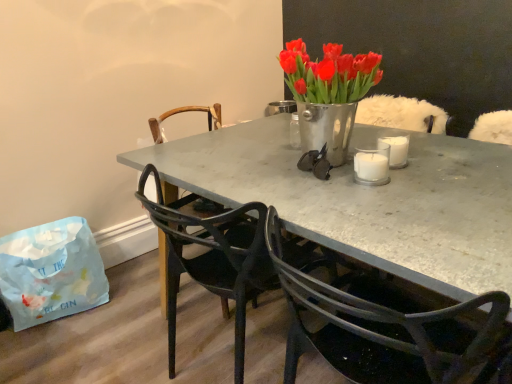
Question: Considering the relative sizes of wooden chair at center, the 1th chair viewed from the back, and matte black chair at center, the second chair from the back, in the image provided, is wooden chair at center, the 1th chair viewed from the back, bigger than matte black chair at center, the second chair from the back,?

Choices:
 (A) no
 (B) yes

Answer: (A)

Question: Considering the relative positions of wooden chair at center, the 3th chair positioned from the front, and matte black chair at center, which is the second chair in front-to-back order, in the image provided, is wooden chair at center, the 3th chair positioned from the front, behind matte black chair at center, which is the second chair in front-to-back order,?

Choices:
 (A) yes
 (B) no

Answer: (A)

Question: Considering the relative positions of wooden chair at center, the 1th chair viewed from the back, and matte black chair at center, the second chair from the back, in the image provided, is wooden chair at center, the 1th chair viewed from the back, to the right of matte black chair at center, the second chair from the back, from the viewer's perspective?

Choices:
 (A) yes
 (B) no

Answer: (B)

Question: Is wooden chair at center, the 3th chair positioned from the front, closer to camera compared to matte black chair at center, the second chair from the back?

Choices:
 (A) yes
 (B) no

Answer: (B)

Question: Considering the relative sizes of wooden chair at center, the 1th chair viewed from the back, and matte black chair at center, which is the second chair in front-to-back order, in the image provided, is wooden chair at center, the 1th chair viewed from the back, taller than matte black chair at center, which is the second chair in front-to-back order,?

Choices:
 (A) yes
 (B) no

Answer: (B)

Question: From the image's perspective, is wooden chair at center, the 3th chair positioned from the front, over matte black chair at center, which is the second chair in front-to-back order?

Choices:
 (A) yes
 (B) no

Answer: (A)

Question: Can you confirm if matte black chair at center, which is the second chair in front-to-back order, is bigger than matte black chair at center, the first chair when ordered from front to back?

Choices:
 (A) yes
 (B) no

Answer: (B)

Question: From the image's perspective, is matte black chair at center, which is the second chair in front-to-back order, above matte black chair at center, the first chair when ordered from front to back?

Choices:
 (A) yes
 (B) no

Answer: (A)

Question: Considering the relative sizes of matte black chair at center, the second chair from the back, and matte black chair at center, which is the 3th chair from back to front, in the image provided, is matte black chair at center, the second chair from the back, smaller than matte black chair at center, which is the 3th chair from back to front,?

Choices:
 (A) yes
 (B) no

Answer: (A)

Question: Can you confirm if matte black chair at center, which is the second chair in front-to-back order, is positioned to the right of matte black chair at center, which is the 3th chair from back to front?

Choices:
 (A) yes
 (B) no

Answer: (B)

Question: Can you confirm if matte black chair at center, which is the second chair in front-to-back order, is positioned to the left of matte black chair at center, the first chair when ordered from front to back?

Choices:
 (A) no
 (B) yes

Answer: (B)

Question: Is matte black chair at center, which is the second chair in front-to-back order, shorter than metallic black glasses at center?

Choices:
 (A) yes
 (B) no

Answer: (B)